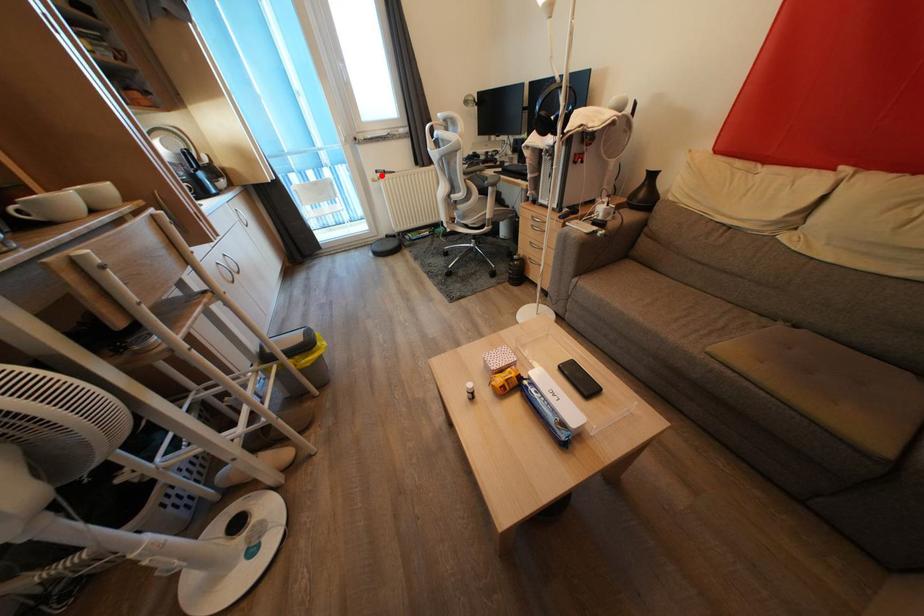
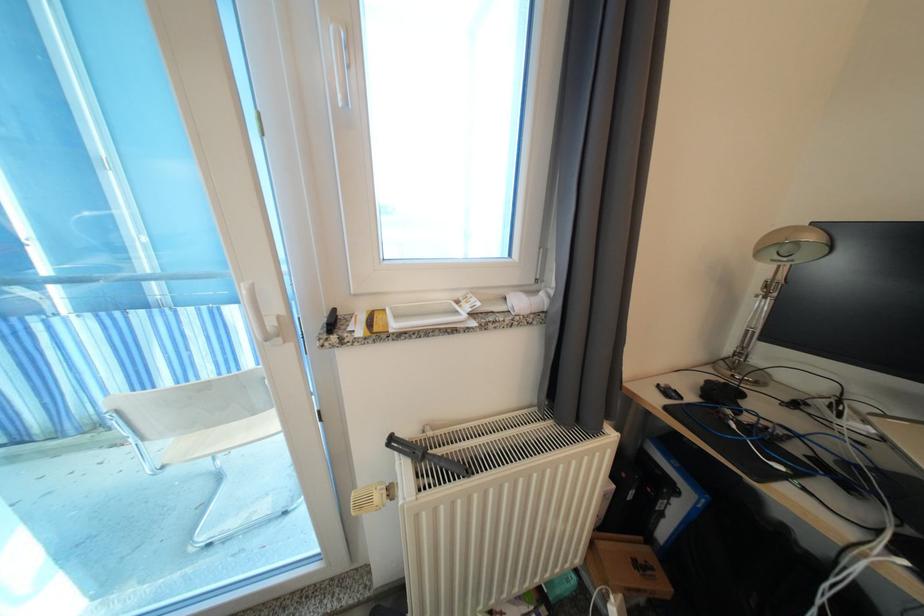
Question: I am providing you with two images of the same scene from different viewpoints. Image1 has a red point marked. In image2, the corresponding 3D location appears at what relative position? Reply with the corresponding letter.

Choices:
 (A) Closer
 (B) Farther

Answer: (B)